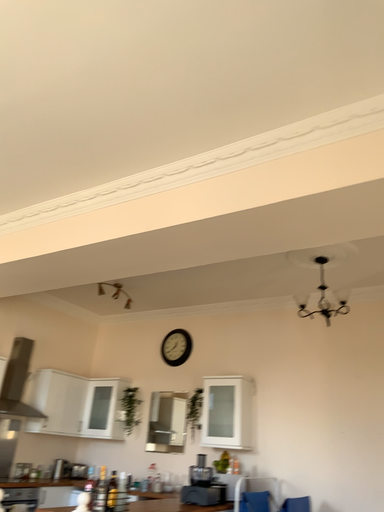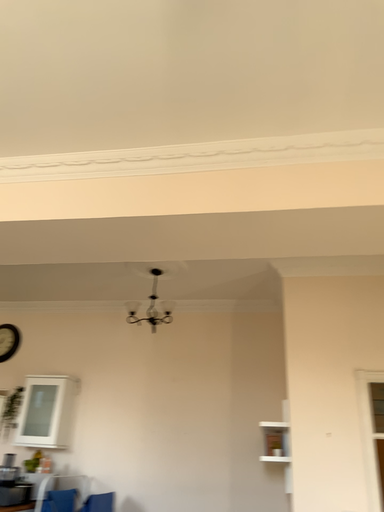
Question: How did the camera likely rotate when shooting the video?

Choices:
 (A) rotated left
 (B) rotated right

Answer: (B)